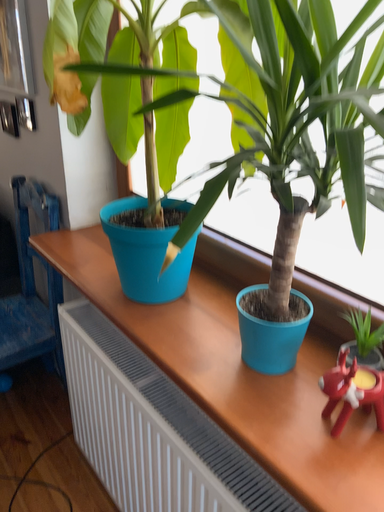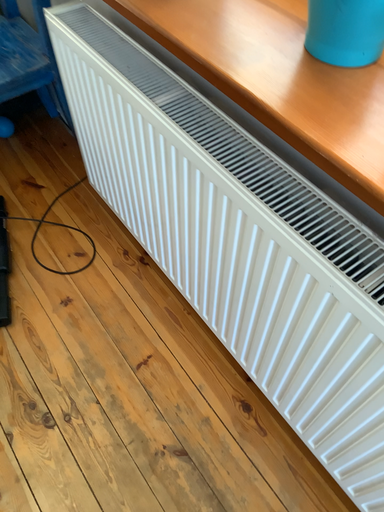
Question: How did the camera likely rotate when shooting the video?

Choices:
 (A) rotated upward
 (B) rotated downward

Answer: (B)